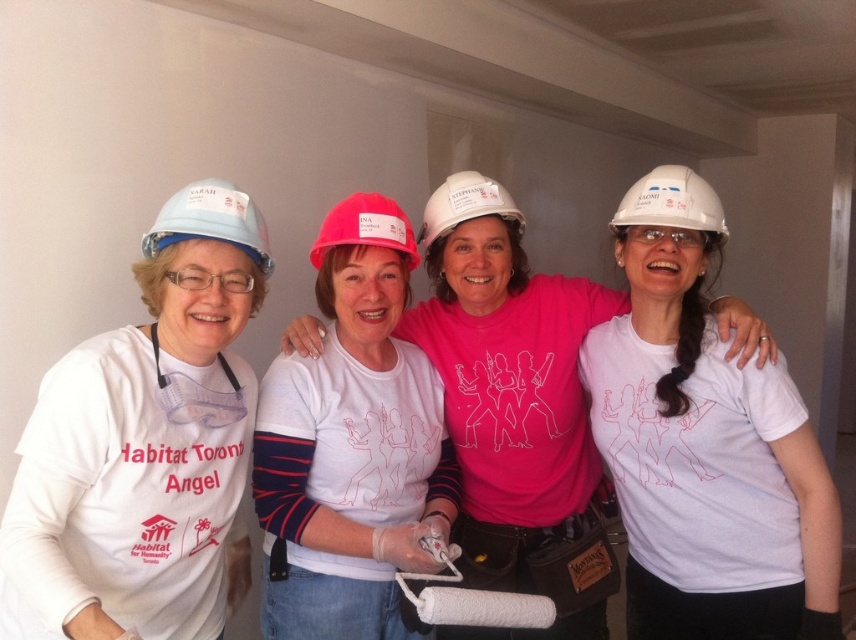
You are a photographer trying to capture a group photo of the volunteers. You want to ensure that both the matte white hard hat at left and the white matte hard hat at center are visible in the frame. Based on their positions, which hard hat should you position closer to the left side of the camera frame?

The matte white hard hat at left is to the left of the white matte hard hat at center, so you should position the matte white hard hat at left closer to the left side of the camera frame to ensure both are visible.